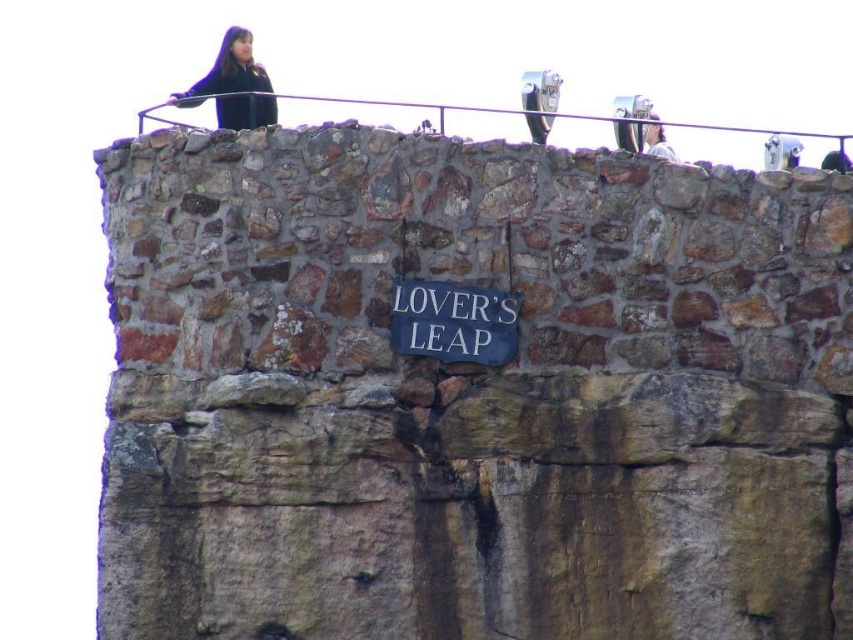
Question: Among these points, which one is nearest to the camera?

Choices:
 (A) (469, 388)
 (B) (654, 118)
 (C) (486, 330)
 (D) (173, 97)

Answer: (A)

Question: Can you confirm if brown stone cliff at upper center is thinner than matte black jacket at upper left?

Choices:
 (A) yes
 (B) no

Answer: (B)

Question: Is matte black jacket at upper left wider than light brown hair at upper right?

Choices:
 (A) no
 (B) yes

Answer: (B)

Question: Which is farther from the white painted wood sign at center?

Choices:
 (A) brown stone cliff at upper center
 (B) matte black jacket at upper left

Answer: (B)

Question: Which is farther from the brown stone cliff at upper center?

Choices:
 (A) white painted wood sign at center
 (B) matte black jacket at upper left

Answer: (B)

Question: Does brown stone cliff at upper center come behind matte black jacket at upper left?

Choices:
 (A) no
 (B) yes

Answer: (A)